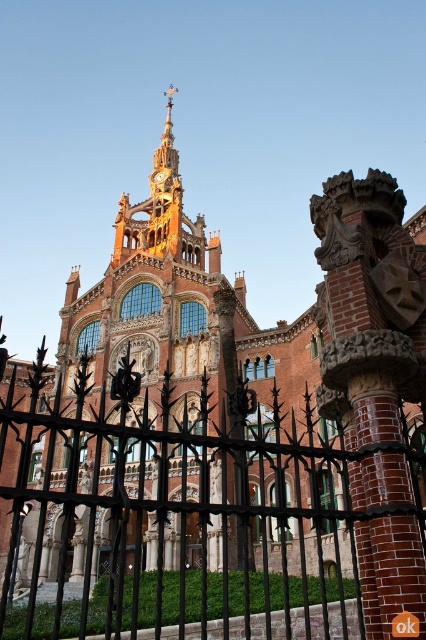
Is black wrought iron fence at center in front of gold metallic clock at center?

Yes, it is.

Between black wrought iron fence at center and gold metallic clock at center, which one is positioned higher?

Positioned higher is gold metallic clock at center.

Who is more forward, (26, 474) or (158, 173)?

Point (26, 474) is in front.

Identify the location of black wrought iron fence at center. Image resolution: width=426 pixels, height=640 pixels. click(209, 513).